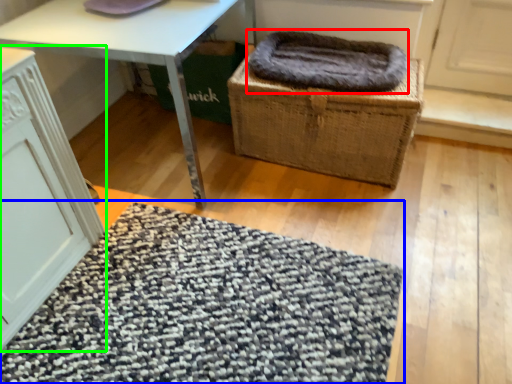
Question: Considering the real-world distances, which object is closest to blanket (highlighted by a red box)? mat (highlighted by a blue box) or cabinetry (highlighted by a green box).

Choices:
 (A) mat
 (B) cabinetry

Answer: (A)